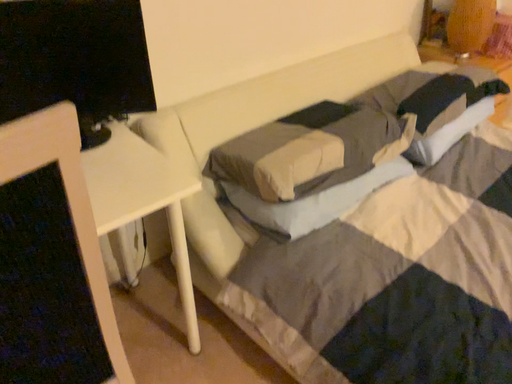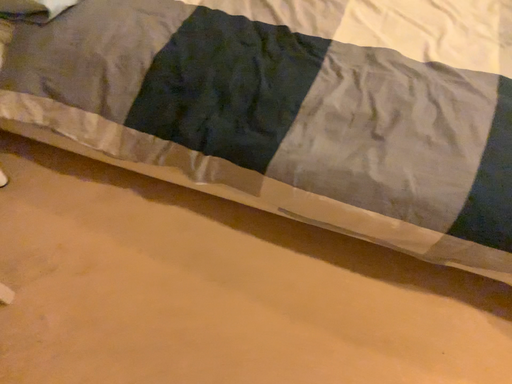
Question: How did the camera likely rotate when shooting the video?

Choices:
 (A) rotated left
 (B) rotated right

Answer: (B)